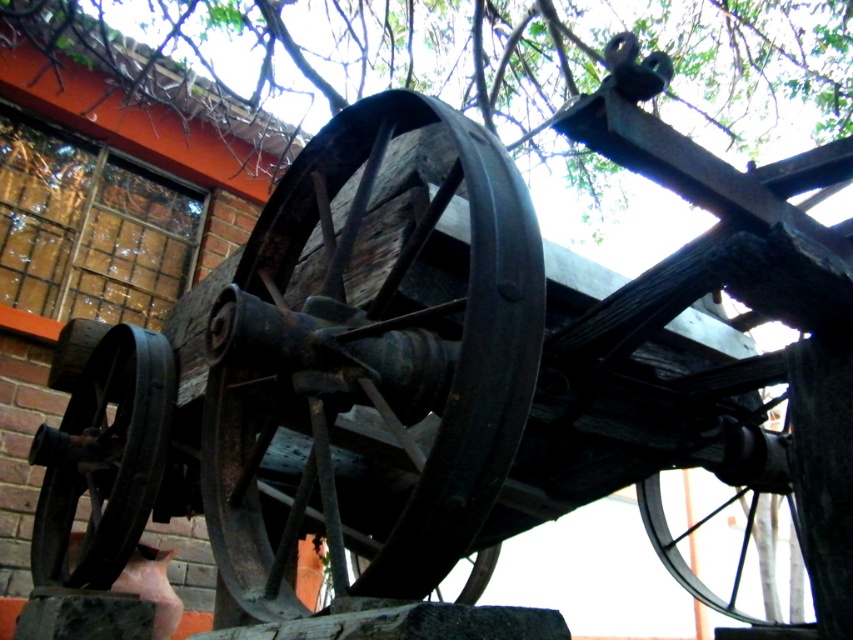
Can you confirm if green wood tree at upper center is shorter than rusty metal wheel at lower left?

No.

Who is positioned more to the right, green wood tree at upper center or rusty metal wheel at lower left?

From the viewer's perspective, green wood tree at upper center appears more on the right side.

What are the coordinates of `green wood tree at upper center` in the screenshot? It's located at (683, 61).

Locate an element on the screen. The width and height of the screenshot is (853, 640). green wood tree at upper center is located at coordinates (683, 61).

Between green wood tree at upper center and rusty metal wheel at lower center, which one is positioned lower?

Positioned lower is rusty metal wheel at lower center.

Is point (547, 99) in front of point (491, 550)?

No.

I want to click on green wood tree at upper center, so click(683, 61).

Locate an element on the screen. green wood tree at upper center is located at coordinates 683,61.

Does rusty metal wheel at lower left appear on the left side of rusty metal wheel at lower center?

Indeed, rusty metal wheel at lower left is positioned on the left side of rusty metal wheel at lower center.

Which is above, rusty metal wheel at lower left or rusty metal wheel at lower center?

Positioned higher is rusty metal wheel at lower left.

Is point (102, 518) behind point (469, 570)?

No, it is not.

Identify the location of rusty metal wheel at lower left. (103, 458).